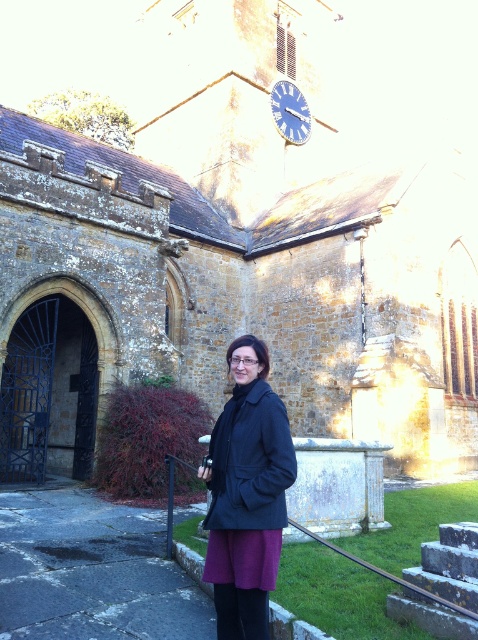
You are a photographer trying to capture the dark blue coat at center and the blue metallic clock at upper center in the same frame. Based on their sizes, which object would appear larger in the photo?

The dark blue coat at center appears larger in the photo because it is taller than the blue metallic clock at upper center.

You are a photographer positioned at the dark blue coat at center. You want to take a photo of the blue metallic clock at upper center. Is the clock within your camera lens range if your camera can focus up to 150 feet?

The dark blue coat at center is 142.05 feet away from the blue metallic clock at upper center. Since the camera can focus up to 150 feet, the clock is within the camera lens range.

You are a photographer trying to capture the scene. You notice the dark blue coat at center and the blue metallic clock at upper center. Which object is closer to the left side of the image?

The dark blue coat at center is to the left of the blue metallic clock at upper center, so it is closer to the left side of the image.